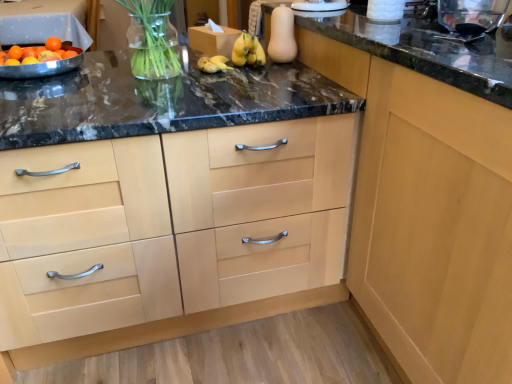
Question: Is light wood cabinet at center, the 2th cabinetry viewed from the left, completely or partially outside of orange matte at upper left?

Choices:
 (A) no
 (B) yes

Answer: (B)

Question: Is light wood cabinet at center, the 2th cabinetry viewed from the left, in front of orange matte at upper left?

Choices:
 (A) yes
 (B) no

Answer: (A)

Question: Can you confirm if light wood cabinet at center, which is counted as the 1th cabinetry, starting from the right, is taller than orange matte at upper left?

Choices:
 (A) yes
 (B) no

Answer: (A)

Question: Would you say orange matte at upper left is part of light wood cabinet at center, which is counted as the 1th cabinetry, starting from the right,'s contents?

Choices:
 (A) yes
 (B) no

Answer: (B)

Question: Is light wood cabinet at center, which is counted as the 1th cabinetry, starting from the right, next to orange matte at upper left?

Choices:
 (A) no
 (B) yes

Answer: (A)

Question: From the image's perspective, is light wood cabinet at center, the 2th cabinetry viewed from the left, over orange matte at upper left?

Choices:
 (A) no
 (B) yes

Answer: (A)

Question: Are light wood cabinet at center, positioned as the second cabinetry in right-to-left order, and orange matte at upper left making contact?

Choices:
 (A) yes
 (B) no

Answer: (B)

Question: Is light wood cabinet at center, marked as the first cabinetry in a left-to-right arrangement, turned away from orange matte at upper left?

Choices:
 (A) yes
 (B) no

Answer: (B)

Question: From a real-world perspective, is light wood cabinet at center, marked as the first cabinetry in a left-to-right arrangement, located higher than orange matte at upper left?

Choices:
 (A) yes
 (B) no

Answer: (B)

Question: Does light wood cabinet at center, marked as the first cabinetry in a left-to-right arrangement, appear on the right side of orange matte at upper left?

Choices:
 (A) yes
 (B) no

Answer: (A)

Question: Is orange matte at upper left completely or partially inside light wood cabinet at center, marked as the first cabinetry in a left-to-right arrangement?

Choices:
 (A) yes
 (B) no

Answer: (B)

Question: Is light wood cabinet at center, marked as the first cabinetry in a left-to-right arrangement, aimed at orange matte at upper left?

Choices:
 (A) no
 (B) yes

Answer: (A)

Question: Could you tell me if orange matte at upper left is facing light wood cabinet at center, the 2th cabinetry viewed from the left?

Choices:
 (A) no
 (B) yes

Answer: (A)